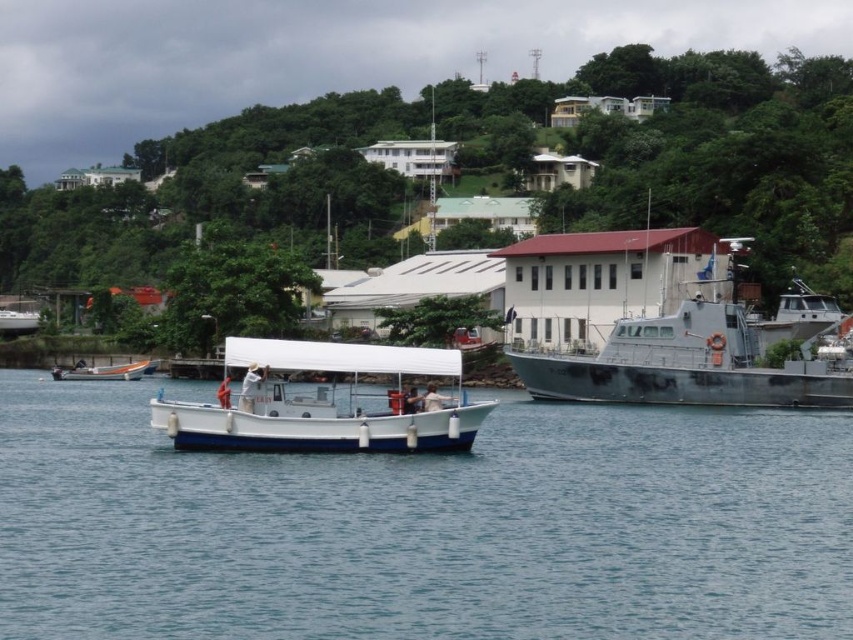
How far apart are white matte water at center and dark gray metallic boat at right?

The distance of white matte water at center from dark gray metallic boat at right is 23.52 meters.

Between point (808, 518) and point (612, 392), which one is positioned in front?

Positioned in front is point (808, 518).

Between point (376, 541) and point (592, 388), which one is positioned in front?

Point (376, 541)

This screenshot has height=640, width=853. In order to click on white matte water at center in this screenshot , I will do `click(424, 525)`.

Between white matte water at center and white plastic boat at center, which one appears on the right side from the viewer's perspective?

white matte water at center

Is white matte water at center bigger than white plastic boat at center?

Yes.

Does point (631, 547) come in front of point (137, 368)?

Yes, it is.

The height and width of the screenshot is (640, 853). In order to click on white matte water at center in this screenshot , I will do `click(424, 525)`.

Does dark gray metallic boat at right have a smaller size compared to white plastic boat at center?

No, dark gray metallic boat at right is not smaller than white plastic boat at center.

Between dark gray metallic boat at right and white plastic boat at center, which one has less height?

white plastic boat at center is shorter.

You are a GUI agent. You are given a task and a screenshot of the screen. Output one action in this format:
    pyautogui.click(x=<x>, y=<y>)
    Task: Click on the dark gray metallic boat at right
    
    Given the screenshot: What is the action you would take?
    pyautogui.click(x=671, y=332)